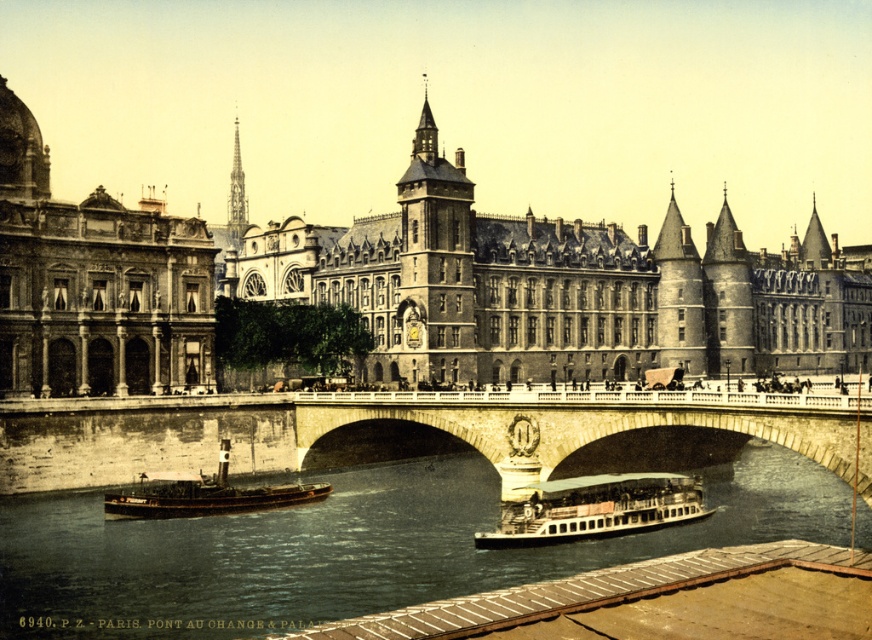
You are a tour guide leading a group near the Pont au Change and Palais de Justice in Paris. You want to show your tourists the stone bridge at center and the wooden polished boat at center. How far apart are these two landmarks?

The stone bridge at center and wooden polished boat at center are 5.31 meters apart from each other.

You are standing at the camera position and want to reach the point at coordinates (346,433). If your walking speed is 1.5 meters per second, how many seconds will it take to reach that point?

The point at coordinates (346,433) is 90.12 meters away from the camera. At a walking speed of 1.5 meters per second, it will take approximately 60.08 seconds to reach it.